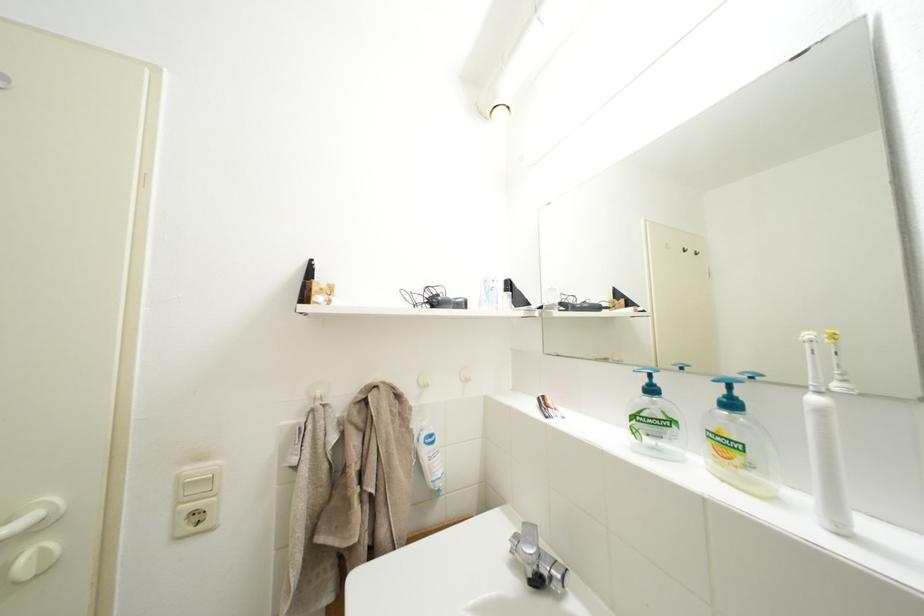
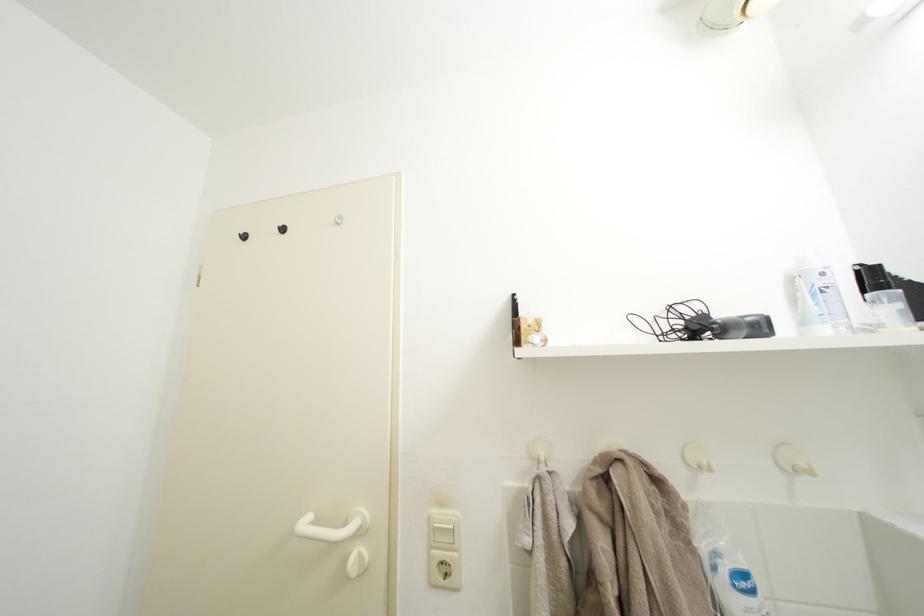
The point at (185, 519) is marked in the first image. Where is the corresponding point in the second image?

(439, 562)